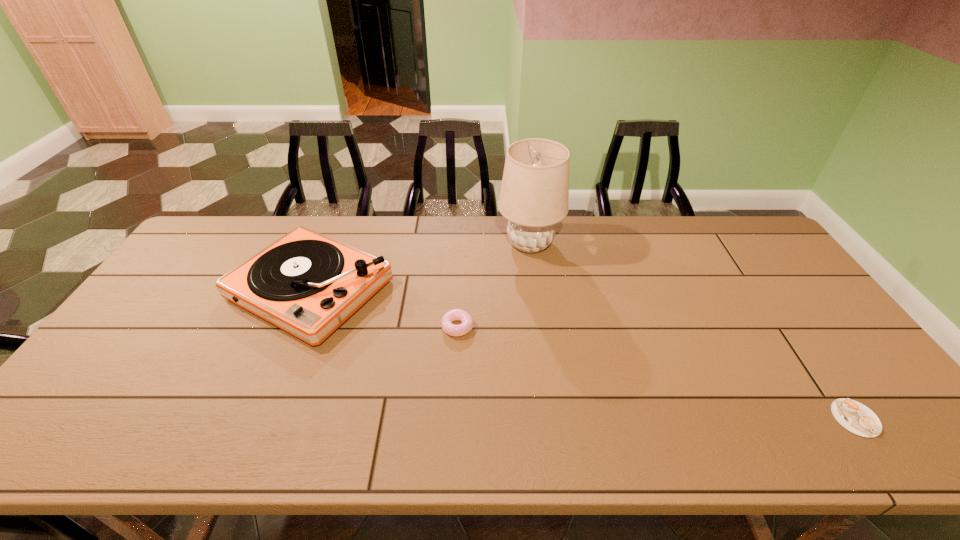
The height and width of the screenshot is (540, 960). I want to click on vacant point at the right edge, so click(838, 355).

The width and height of the screenshot is (960, 540). I want to click on free space at the near right corner, so click(x=883, y=441).

The height and width of the screenshot is (540, 960). In order to click on free space between the third object from right to left and the cappuccino in this screenshot , I will do `click(657, 373)`.

Identify the location of empty location between the second tallest object and the lampshade. This screenshot has width=960, height=540. (x=420, y=266).

At what (x,y) coordinates should I click in order to perform the action: click on free space between the leftmost object and the rightmost object. Please return your answer as a coordinate pair (x, y). This screenshot has width=960, height=540. Looking at the image, I should click on (583, 353).

You are a GUI agent. You are given a task and a screenshot of the screen. Output one action in this format:
    pyautogui.click(x=<x>, y=<y>)
    Task: Click on the free space between the cappuccino and the third object from right to left
    The height and width of the screenshot is (540, 960).
    Given the screenshot: What is the action you would take?
    pyautogui.click(x=657, y=373)

Image resolution: width=960 pixels, height=540 pixels. I want to click on free space between the doughnut and the nearest object, so click(x=657, y=373).

I want to click on vacant area between the second object from right to left and the shortest object, so click(x=692, y=331).

This screenshot has height=540, width=960. Find the location of `free spot between the leftmost object and the second object from right to left`. free spot between the leftmost object and the second object from right to left is located at coordinates (420, 266).

This screenshot has width=960, height=540. In order to click on free space between the lampshade and the doughnut in this screenshot , I will do `click(493, 285)`.